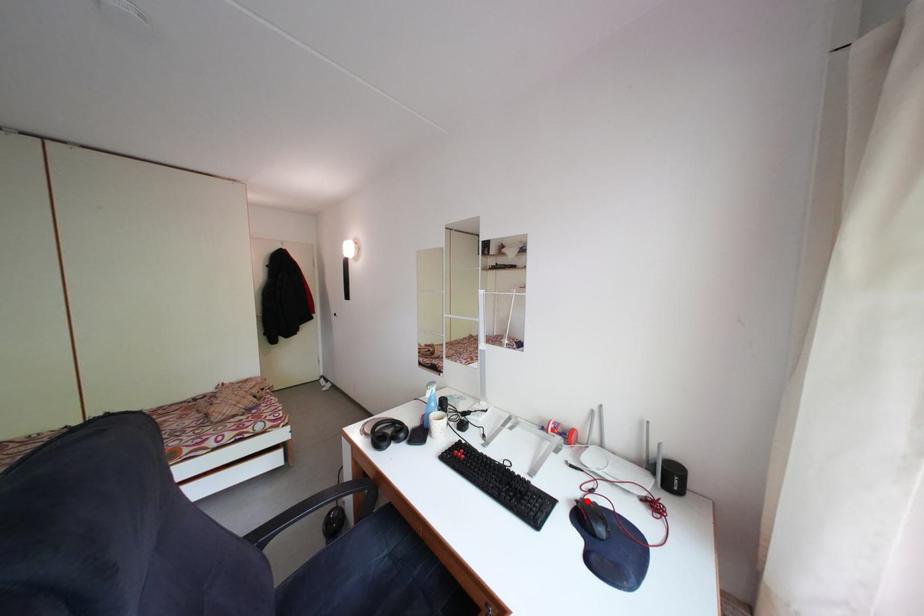
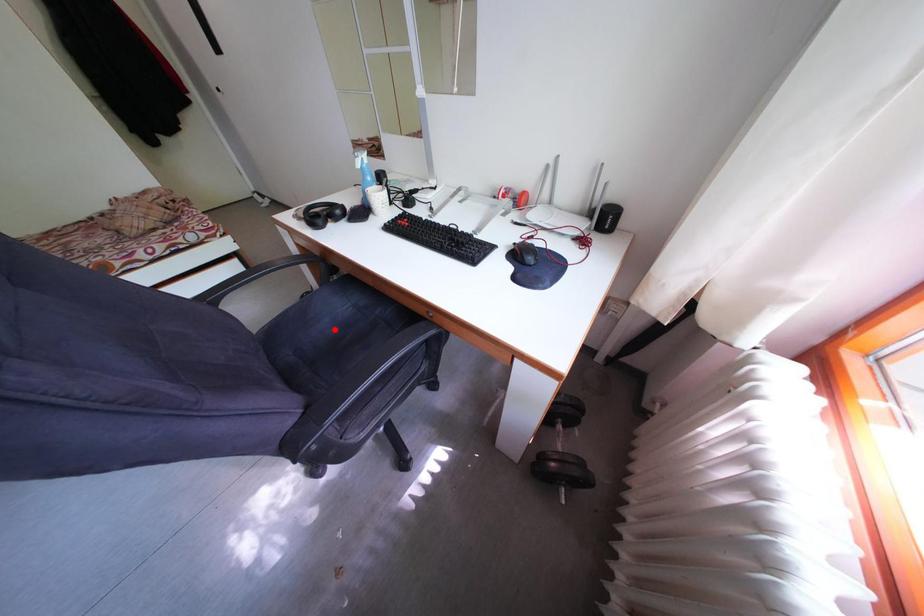
I am providing you with two images of the same scene from different viewpoints. A red point is marked on the first image and another point is marked on the second image. Do the highlighted points in image1 and image2 indicate the same real-world spot?

No